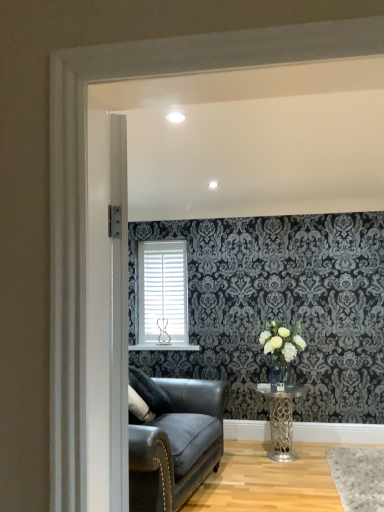
Question: In the image, is white matte vase at center-right positioned in front of or behind white matte blinds at center?

Choices:
 (A) front
 (B) behind

Answer: (A)

Question: In terms of width, does white matte vase at center-right look wider or thinner when compared to white matte blinds at center?

Choices:
 (A) thin
 (B) wide

Answer: (B)

Question: Which of these objects is positioned closest to the metallic silver table at lower center?

Choices:
 (A) white matte blinds at center
 (B) white matte vase at center-right
 (C) clear glass vase at center

Answer: (C)

Question: Estimate the real-world distances between objects in this image. Which object is closer to the clear glass vase at center?

Choices:
 (A) white matte vase at center-right
 (B) white matte blinds at center
 (C) metallic silver table at lower center

Answer: (A)